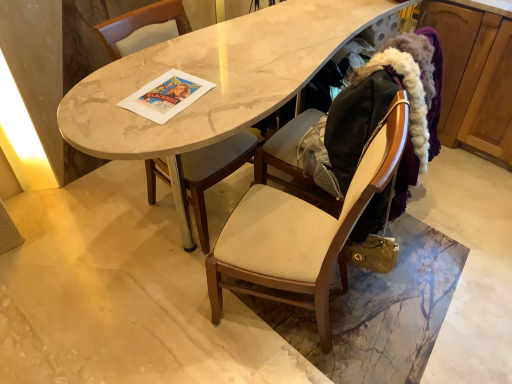
Locate an element on the screen. vacant area in front of matte gray cushioned chair at center, which appears as the 2th chair when viewed from the right is located at coordinates (148, 290).